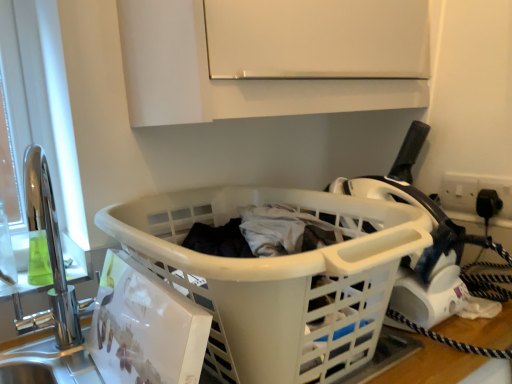
In order to face white plastic laundry basket at center, should I rotate leftwards or rightwards?

You should rotate left by 1.166 degrees.

Describe the element at coordinates (277, 279) in the screenshot. I see `white plastic laundry basket at center` at that location.

This screenshot has height=384, width=512. I want to click on white plastic laundry basket at center, so click(277, 279).

What is the approximate width of white plastic laundry basket at center?

It is 25.60 inches.

Where is `white matte cabinet at upper center`? This screenshot has height=384, width=512. white matte cabinet at upper center is located at coordinates (x=224, y=80).

What do you see at coordinates (224, 80) in the screenshot?
I see `white matte cabinet at upper center` at bounding box center [224, 80].

Image resolution: width=512 pixels, height=384 pixels. I want to click on white plastic laundry basket at center, so click(x=277, y=279).

Is white plastic laundry basket at center to the left of white matte cabinet at upper center from the viewer's perspective?

Yes.

Is white plastic laundry basket at center behind white matte cabinet at upper center?

That is False.

Is point (285, 194) closer or farther from the camera than point (406, 85)?

Point (285, 194) appears to be closer to the viewer than point (406, 85).

From the image's perspective, which is above, white plastic laundry basket at center or white matte cabinet at upper center?

white matte cabinet at upper center.

From a real-world perspective, which is physically below, white plastic laundry basket at center or white matte cabinet at upper center?

From a 3D spatial view, white plastic laundry basket at center is below.

Is white plastic laundry basket at center wider or thinner than white matte cabinet at upper center?

Considering their sizes, white plastic laundry basket at center looks broader than white matte cabinet at upper center.

In terms of height, does white plastic laundry basket at center look taller or shorter compared to white matte cabinet at upper center?

Considering their sizes, white plastic laundry basket at center has less height than white matte cabinet at upper center.

Considering the relative sizes of white plastic laundry basket at center and white matte cabinet at upper center in the image provided, is white plastic laundry basket at center smaller than white matte cabinet at upper center?

Yes.

Is white plastic laundry basket at center completely or partially outside of white matte cabinet at upper center?

Absolutely, white plastic laundry basket at center is external to white matte cabinet at upper center.

Would you say white plastic laundry basket at center is a long distance from white matte cabinet at upper center?

No, there isn't a large distance between white plastic laundry basket at center and white matte cabinet at upper center.

Is white plastic laundry basket at center facing away from white matte cabinet at upper center?

white plastic laundry basket at center does not have its back to white matte cabinet at upper center.

How many degrees apart are the facing directions of white plastic laundry basket at center and white matte cabinet at upper center?

white plastic laundry basket at center and white matte cabinet at upper center are facing 0.0118 degrees away from each other.

Measure the distance between white plastic laundry basket at center and white matte cabinet at upper center.

white plastic laundry basket at center and white matte cabinet at upper center are 11.51 inches apart from each other.

I want to click on cabinetry behind the white plastic laundry basket at center, so click(224, 80).

Does white matte cabinet at upper center appear on the right side of white plastic laundry basket at center?

Correct, you'll find white matte cabinet at upper center to the right of white plastic laundry basket at center.

Considering their positions, is white matte cabinet at upper center located in front of or behind white plastic laundry basket at center?

Clearly, white matte cabinet at upper center is behind white plastic laundry basket at center.

Which is nearer, [189,70] or [370,358]?

Point [189,70].

From the image's perspective, is white matte cabinet at upper center under white plastic laundry basket at center?

No, from the image's perspective, white matte cabinet at upper center is not below white plastic laundry basket at center.

From a real-world perspective, is white matte cabinet at upper center positioned above or below white plastic laundry basket at center?

Clearly, from a real-world perspective, white matte cabinet at upper center is above white plastic laundry basket at center.

Considering the sizes of objects white matte cabinet at upper center and white plastic laundry basket at center in the image provided, who is wider, white matte cabinet at upper center or white plastic laundry basket at center?

Wider between the two is white plastic laundry basket at center.

Considering the sizes of objects white matte cabinet at upper center and white plastic laundry basket at center in the image provided, who is shorter, white matte cabinet at upper center or white plastic laundry basket at center?

With less height is white plastic laundry basket at center.

Is white matte cabinet at upper center bigger than white plastic laundry basket at center?

Indeed, white matte cabinet at upper center has a larger size compared to white plastic laundry basket at center.

Based on the photo, is white matte cabinet at upper center spatially inside white plastic laundry basket at center, or outside of it?

white matte cabinet at upper center is outside white plastic laundry basket at center.

Consider the image. Is the surface of white matte cabinet at upper center in direct contact with white plastic laundry basket at center?

No, white matte cabinet at upper center is not next to white plastic laundry basket at center.

Is white matte cabinet at upper center facing away from white plastic laundry basket at center?

No, white matte cabinet at upper center's orientation is not away from white plastic laundry basket at center.

How different are the orientations of white matte cabinet at upper center and white plastic laundry basket at center in degrees?

There is a 0.0118-degree angle between the facing directions of white matte cabinet at upper center and white plastic laundry basket at center.

The image size is (512, 384). I want to click on basket located on the left of white matte cabinet at upper center, so click(x=277, y=279).

Where is `basket that is below the white matte cabinet at upper center (from the image's perspective)`? This screenshot has width=512, height=384. basket that is below the white matte cabinet at upper center (from the image's perspective) is located at coordinates [277, 279].

Identify the location of basket that appears in front of the white matte cabinet at upper center. (277, 279).